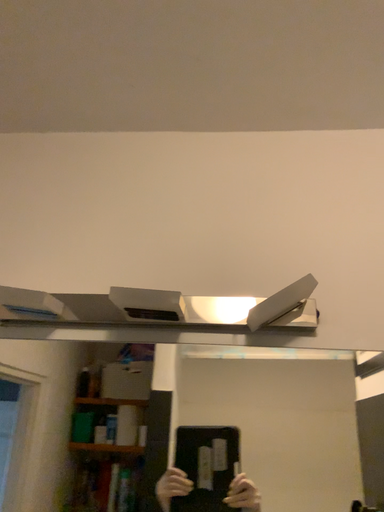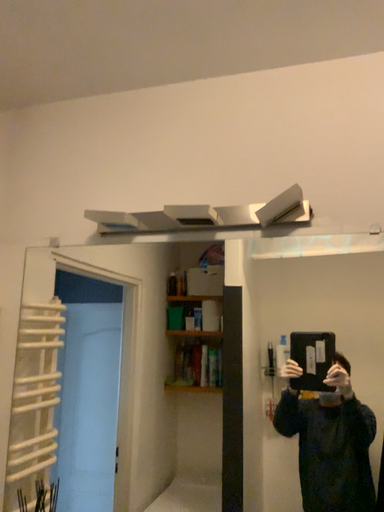
Question: How did the camera likely rotate when shooting the video?

Choices:
 (A) rotated downward
 (B) rotated upward

Answer: (A)